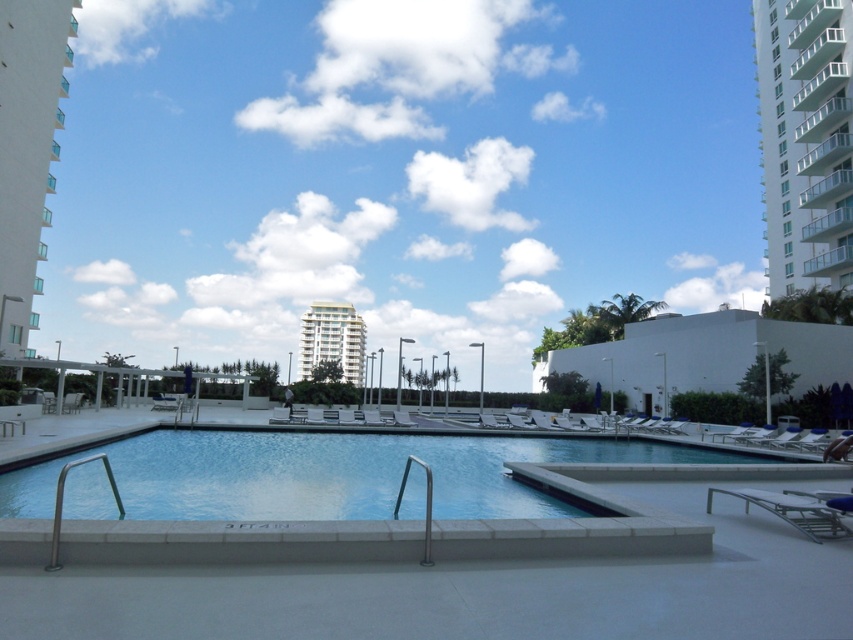
You are standing at the edge of the pool and want to walk to the white glass building at left and the white glossy building at center. Which building is closer to your current position?

The white glass building at left is closer to your current position because it is only 41.50 meters away from the white glossy building at center, so the white glass building at left is closer.

You are standing at the edge of the pool and want to take a photo of both the point at coordinates (799, 145) and the point at (311, 339). Which point should you focus on first to ensure both are in clear view?

You should focus on the point at coordinates (799, 145) first because it is closer to the camera than the point at (311, 339). This ensures both points will be in focus when taking the photo.

You are standing at the edge of the pool and want to walk towards the white glossy building at center. Which direction should you walk relative to the white glass building at left?

You should walk away from the white glass building at left because the white glossy building at center is further away from you.